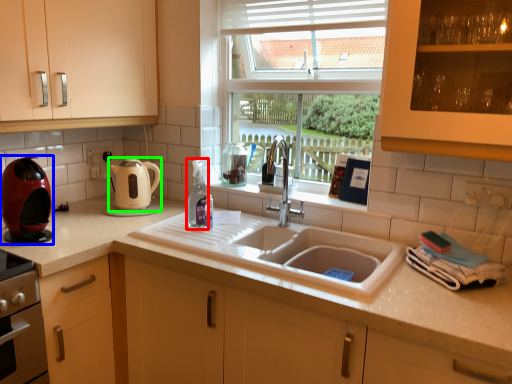
Question: Which is farther away from bottle (highlighted by a red box)? kitchen appliance (highlighted by a blue box) or kitchen appliance (highlighted by a green box)?

Choices:
 (A) kitchen appliance
 (B) kitchen appliance

Answer: (A)